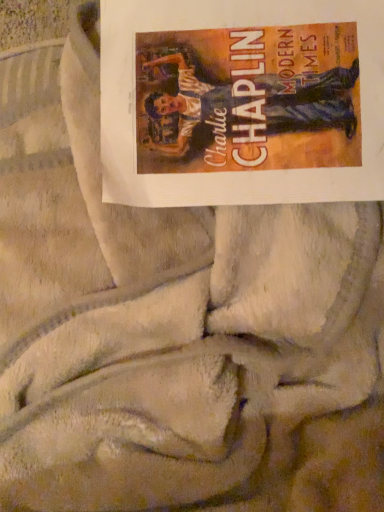
This screenshot has height=512, width=384. Describe the element at coordinates (242, 101) in the screenshot. I see `matte paper poster at upper center` at that location.

The height and width of the screenshot is (512, 384). I want to click on matte paper poster at upper center, so click(242, 101).

Where is `matte paper poster at upper center`? matte paper poster at upper center is located at coordinates (242, 101).